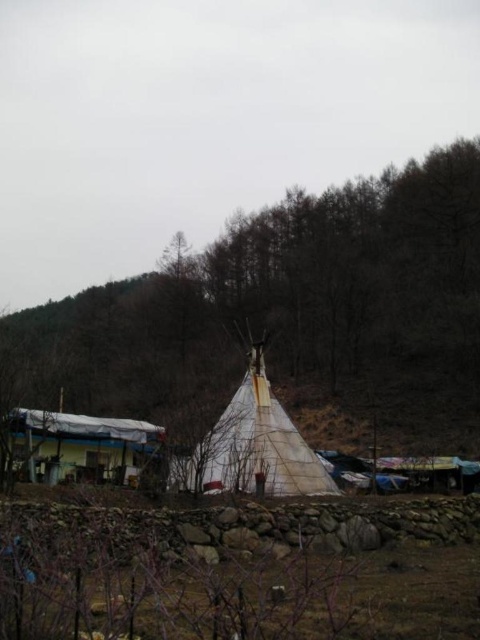
Question: Does white fabric teepee at center come behind white canvas tent at lower left?

Choices:
 (A) yes
 (B) no

Answer: (A)

Question: Can you confirm if white fabric teepee at center is positioned above white canvas tent at lower left?

Choices:
 (A) yes
 (B) no

Answer: (A)

Question: Which point is farther to the camera?

Choices:
 (A) white canvas tent at center
 (B) white fabric teepee at center
 (C) white canvas tent at lower left

Answer: (A)

Question: Which point appears closest to the camera in this image?

Choices:
 (A) (109, 472)
 (B) (384, 268)
 (C) (228, 449)

Answer: (C)

Question: Considering the real-world distances, which object is closest to the white canvas tent at center?

Choices:
 (A) white fabric teepee at center
 (B) white canvas tent at lower left

Answer: (B)

Question: Is the position of white canvas tent at center less distant than that of white canvas tent at lower left?

Choices:
 (A) yes
 (B) no

Answer: (B)